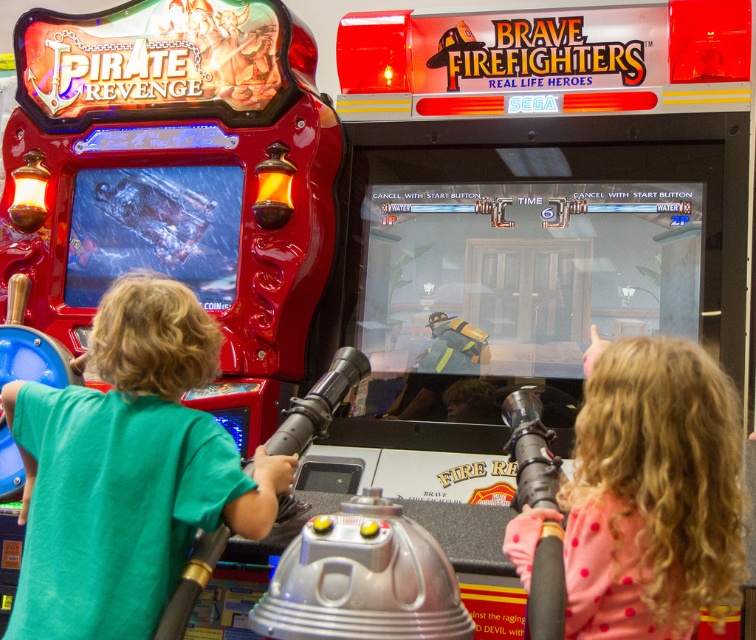
Can you confirm if green matte shirt at left is bigger than pink dotted shirt at right?

No, green matte shirt at left is not bigger than pink dotted shirt at right.

Who is shorter, green matte shirt at left or pink dotted shirt at right?

With less height is pink dotted shirt at right.

Is point (56, 502) positioned behind point (699, 552)?

Yes, point (56, 502) is farther from viewer.

I want to click on green matte shirt at left, so [126, 470].